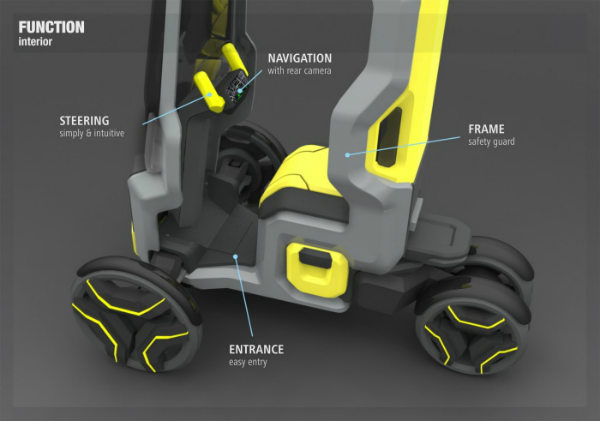
The height and width of the screenshot is (421, 600). I want to click on dark gray and yellow seat, so click(312, 172).